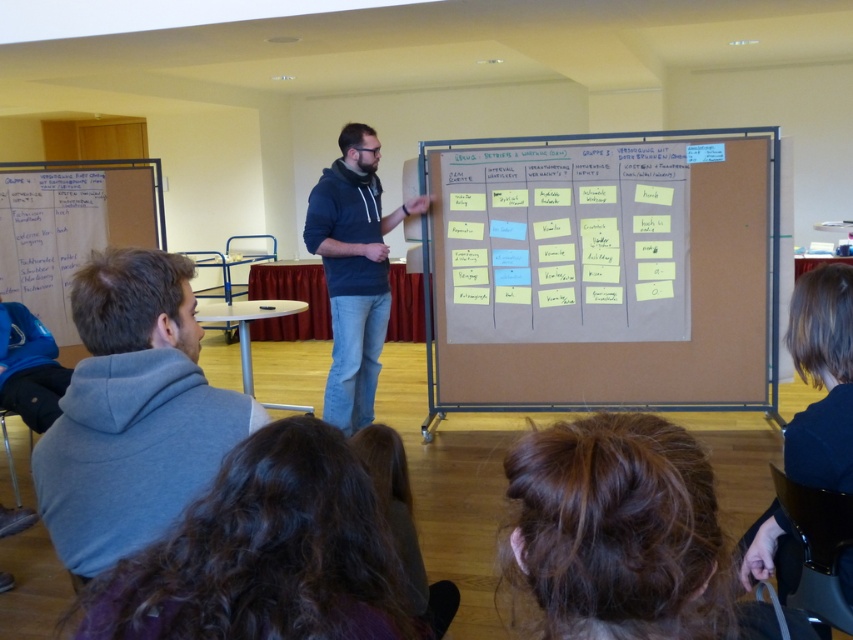
Question: Which object appears closest to the camera in this image?

Choices:
 (A) brown hair at lower right
 (B) gray hoodie at lower left
 (C) white paperboard at left
 (D) dark blue hoodie at center

Answer: (B)

Question: Can you confirm if brown cardboard at center is wider than white paperboard at left?

Choices:
 (A) yes
 (B) no

Answer: (A)

Question: Is brown cardboard at center to the right of cardboard poster at center from the viewer's perspective?

Choices:
 (A) no
 (B) yes

Answer: (B)

Question: Among these objects, which one is nearest to the camera?

Choices:
 (A) cardboard poster at center
 (B) white paperboard at left
 (C) dark blue hoodie at center
 (D) brown hair at lower right

Answer: (D)

Question: Is gray hoodie at lower left closer to camera compared to brown hair at lower right?

Choices:
 (A) yes
 (B) no

Answer: (A)

Question: Among these objects, which one is nearest to the camera?

Choices:
 (A) brown cardboard at center
 (B) gray hoodie at lower left
 (C) brown hair at lower right

Answer: (B)